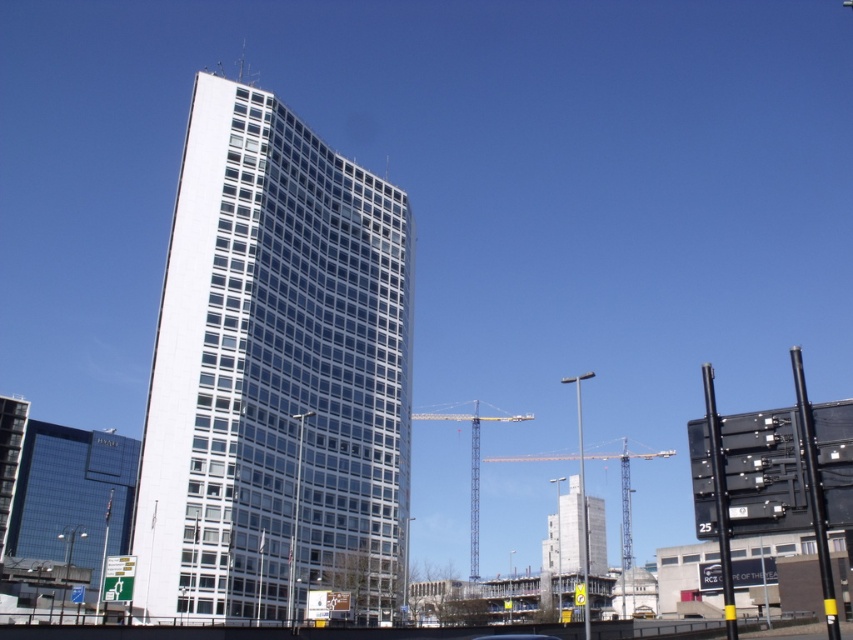
Between yellow metallic crane at center and metallic yellow crane at center, which one is positioned lower?

Positioned lower is metallic yellow crane at center.

Who is positioned more to the left, yellow metallic crane at center or metallic yellow crane at center?

yellow metallic crane at center

Does point (479, 451) come farther from viewer compared to point (624, 499)?

No, (479, 451) is in front of (624, 499).

This screenshot has height=640, width=853. I want to click on yellow metallic crane at center, so click(473, 468).

Is white glass building at center to the left of yellow metallic crane at center from the viewer's perspective?

Correct, you'll find white glass building at center to the left of yellow metallic crane at center.

Is white glass building at center positioned at the back of yellow metallic crane at center?

No.

Is point (341, 420) farther from viewer compared to point (444, 412)?

That is False.

This screenshot has height=640, width=853. Identify the location of white glass building at center. (276, 376).

Can you confirm if white concrete building at center is positioned to the right of metallic yellow crane at center?

No, white concrete building at center is not to the right of metallic yellow crane at center.

How far apart are white concrete building at center and metallic yellow crane at center?

white concrete building at center and metallic yellow crane at center are 17.71 meters apart from each other.

Between point (590, 502) and point (627, 465), which one is positioned behind?

Positioned behind is point (627, 465).

The image size is (853, 640). Identify the location of white concrete building at center. pos(564,532).